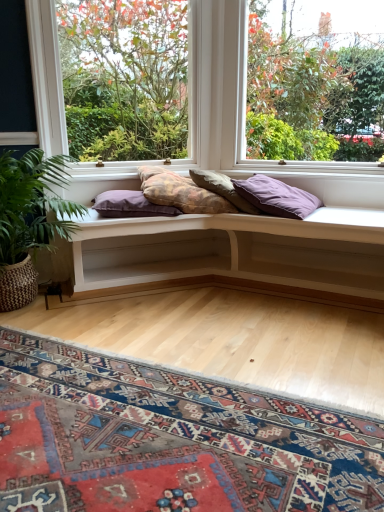
Question: Considering the relative sizes of purple fabric pillow at center, placed as the fourth pillow when sorted from right to left, and clear glass window at upper right, positioned as the second window in left-to-right order, in the image provided, is purple fabric pillow at center, placed as the fourth pillow when sorted from right to left, thinner than clear glass window at upper right, positioned as the second window in left-to-right order,?

Choices:
 (A) yes
 (B) no

Answer: (B)

Question: Is purple fabric pillow at center, the first pillow from the left, to the right of clear glass window at upper right, positioned as the second window in left-to-right order, from the viewer's perspective?

Choices:
 (A) no
 (B) yes

Answer: (A)

Question: Is purple fabric pillow at center, placed as the fourth pillow when sorted from right to left, wider than clear glass window at upper right, the first window positioned from the right?

Choices:
 (A) yes
 (B) no

Answer: (A)

Question: Would you consider purple fabric pillow at center, the first pillow from the left, to be distant from clear glass window at upper right, the first window positioned from the right?

Choices:
 (A) no
 (B) yes

Answer: (B)

Question: Is purple fabric pillow at center, placed as the fourth pillow when sorted from right to left, in front of clear glass window at upper right, the first window positioned from the right?

Choices:
 (A) yes
 (B) no

Answer: (B)

Question: From the image's perspective, is white wood bench at center located above or below carpeted mat at lower center?

Choices:
 (A) below
 (B) above

Answer: (B)

Question: Is white wood bench at center inside the boundaries of carpeted mat at lower center, or outside?

Choices:
 (A) outside
 (B) inside

Answer: (A)

Question: Based on their sizes in the image, would you say white wood bench at center is bigger or smaller than carpeted mat at lower center?

Choices:
 (A) big
 (B) small

Answer: (A)

Question: Is point [256, 263] positioned closer to the camera than point [3, 356]?

Choices:
 (A) farther
 (B) closer

Answer: (A)

Question: From the image's perspective, relative to textured beige pillow at center, acting as the second pillow starting from the right, is white wood bench at center above or below?

Choices:
 (A) above
 (B) below

Answer: (B)

Question: Is white wood bench at center wider or thinner than textured beige pillow at center, acting as the second pillow starting from the right?

Choices:
 (A) thin
 (B) wide

Answer: (B)

Question: From a real-world perspective, is white wood bench at center positioned above or below textured beige pillow at center, the 3th pillow when ordered from left to right?

Choices:
 (A) above
 (B) below

Answer: (B)

Question: In the image, is white wood bench at center positioned in front of or behind textured beige pillow at center, the 3th pillow when ordered from left to right?

Choices:
 (A) behind
 (B) front

Answer: (B)

Question: From a real-world perspective, is textured purple pillow at center, which ranks as the 2th pillow in left-to-right order, positioned above or below white wood bench at center?

Choices:
 (A) above
 (B) below

Answer: (A)

Question: Is textured purple pillow at center, the third pillow positioned from the right, spatially inside white wood bench at center, or outside of it?

Choices:
 (A) outside
 (B) inside

Answer: (A)